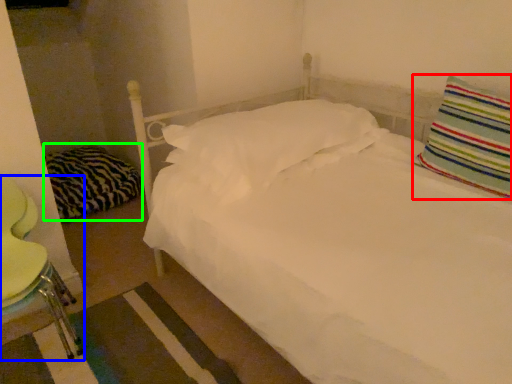
Question: Which object is positioned farthest from pillow (highlighted by a red box)? Select from swivel chair (highlighted by a blue box) and pillow (highlighted by a green box).

Choices:
 (A) swivel chair
 (B) pillow

Answer: (B)